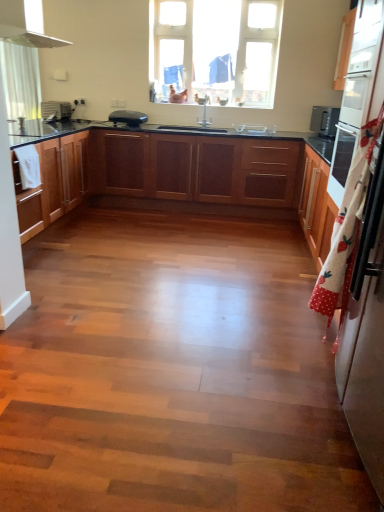
Question: From a real-world perspective, is white glossy refrigerator at right located higher than wooden cabinets at left, acting as the 2th cabinetry starting from the back?

Choices:
 (A) yes
 (B) no

Answer: (A)

Question: Does white glossy refrigerator at right appear on the right side of wooden cabinets at left, acting as the 2th cabinetry starting from the back?

Choices:
 (A) yes
 (B) no

Answer: (A)

Question: Is white glossy refrigerator at right positioned beyond the bounds of wooden cabinets at left, acting as the second cabinetry starting from the front?

Choices:
 (A) no
 (B) yes

Answer: (B)

Question: Is white glossy refrigerator at right bigger than wooden cabinets at left, acting as the second cabinetry starting from the front?

Choices:
 (A) no
 (B) yes

Answer: (A)

Question: From the image's perspective, is white glossy refrigerator at right located above wooden cabinets at left, acting as the 2th cabinetry starting from the back?

Choices:
 (A) no
 (B) yes

Answer: (A)

Question: Is wooden cabinets at center, which ranks as the 1th cabinetry in front-to-back order, inside or outside of transparent glass window at upper center?

Choices:
 (A) inside
 (B) outside

Answer: (B)

Question: Considering their positions, is wooden cabinets at center, which ranks as the 1th cabinetry in front-to-back order, located in front of or behind transparent glass window at upper center?

Choices:
 (A) behind
 (B) front

Answer: (B)

Question: Does point (119, 187) appear closer or farther from the camera than point (167, 33)?

Choices:
 (A) closer
 (B) farther

Answer: (A)

Question: In terms of height, does wooden cabinets at center, which ranks as the 1th cabinetry in front-to-back order, look taller or shorter compared to transparent glass window at upper center?

Choices:
 (A) short
 (B) tall

Answer: (A)

Question: In the image, is white polka dot fabric at right on the left side or the right side of matte black toaster at left, which appears as the 2th appliance when viewed from the right?

Choices:
 (A) right
 (B) left

Answer: (A)

Question: Considering the positions of white polka dot fabric at right and matte black toaster at left, marked as the 1th appliance in a left-to-right arrangement, in the image, is white polka dot fabric at right taller or shorter than matte black toaster at left, marked as the 1th appliance in a left-to-right arrangement,?

Choices:
 (A) short
 (B) tall

Answer: (B)

Question: Is white polka dot fabric at right wider or thinner than matte black toaster at left, marked as the 1th appliance in a left-to-right arrangement?

Choices:
 (A) wide
 (B) thin

Answer: (B)

Question: Choose the correct answer: Is white polka dot fabric at right inside matte black toaster at left, which appears as the 2th appliance when viewed from the right, or outside it?

Choices:
 (A) inside
 (B) outside

Answer: (B)

Question: From a real-world perspective, is black plastic toaster at upper center, the 2th appliance viewed from the left, positioned above or below white glossy sink at center?

Choices:
 (A) above
 (B) below

Answer: (A)

Question: Is black plastic toaster at upper center, the 2th appliance viewed from the left, taller or shorter than white glossy sink at center?

Choices:
 (A) short
 (B) tall

Answer: (B)